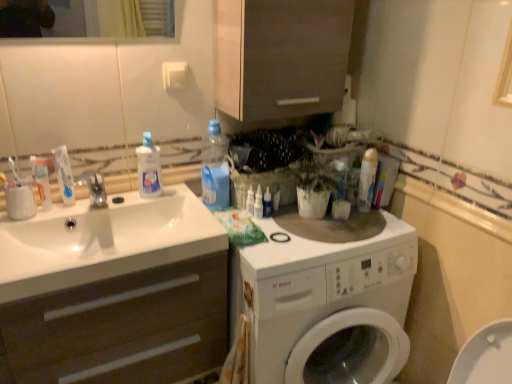
The width and height of the screenshot is (512, 384). In order to click on vacant area that is in front of white glossy toothpaste at left, which appears as the second toothpaste when viewed from the left in this screenshot , I will do `click(51, 222)`.